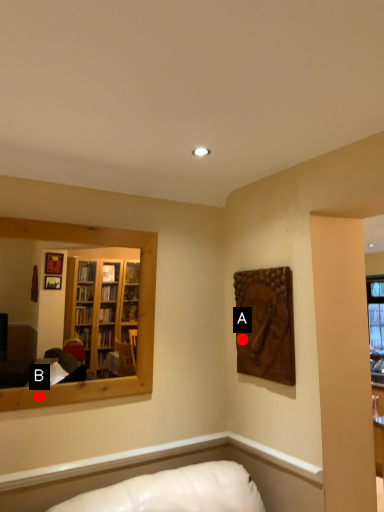
Question: Two points are circled on the image, labeled by A and B beside each circle. Which point is closer to the camera?

Choices:
 (A) A is closer
 (B) B is closer

Answer: (B)